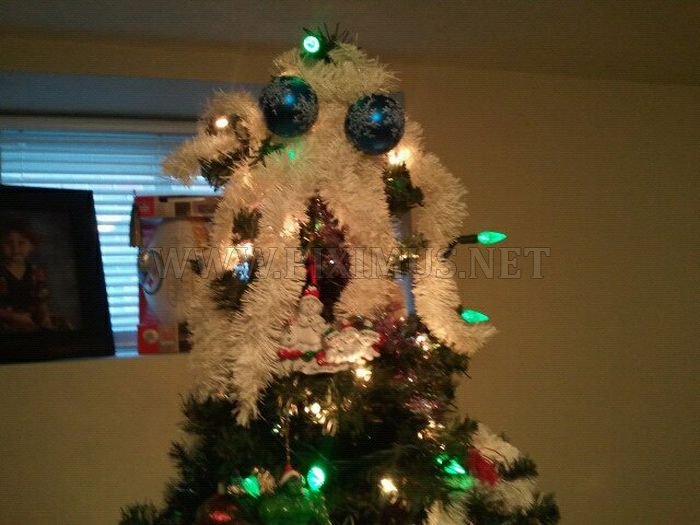
The width and height of the screenshot is (700, 525). I want to click on green lights, so click(x=470, y=314), click(x=491, y=240), click(x=314, y=45), click(x=316, y=475), click(x=245, y=481), click(x=456, y=470).